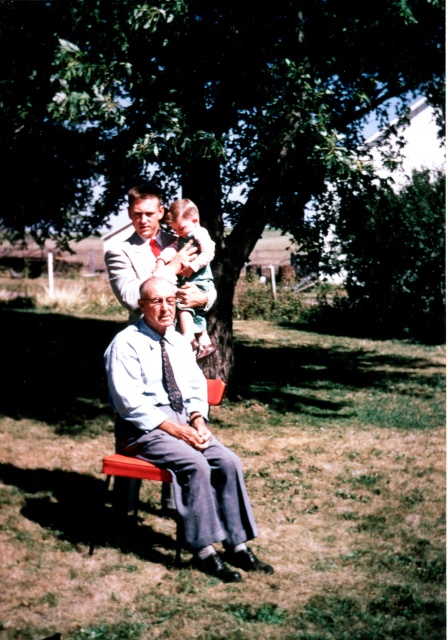
You are an observer looking at the scene. Which object takes up more space in the image, the green leafy tree at upper center or the light blue fabric shirt at center?

The green leafy tree at upper center is larger in size than the light blue fabric shirt at center, so it takes up more space in the image.

You are a photographer trying to capture a portrait of the person in the light blue fabric shirt at center. The green leafy tree at upper center is casting a shadow. Will the tree block the sunlight needed for the portrait?

The green leafy tree at upper center is above the light blue fabric shirt at center, so it may cast a shadow over them, potentially blocking sunlight. Adjust the position or use additional lighting to ensure proper illumination.

You are a photographer trying to capture a clear shot of the dark gray textured tie at center and the green leafy tree at upper center. Which object is positioned behind the other?

The dark gray textured tie at center is behind the green leafy tree at upper center, so the tree partially obscures the tie in the image.